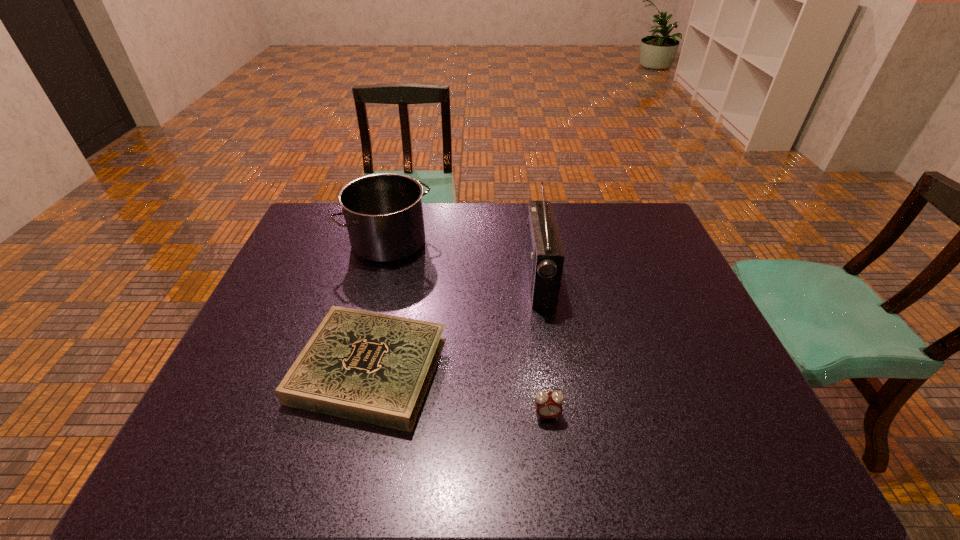
Identify the location of radio receiver. (544, 254).

At what (x,y) coordinates should I click in order to perform the action: click on saucepan. Please return your answer as a coordinate pair (x, y). The height and width of the screenshot is (540, 960). Looking at the image, I should click on (383, 212).

At what (x,y) coordinates should I click in order to perform the action: click on the third tallest object. Please return your answer as a coordinate pair (x, y). This screenshot has width=960, height=540. Looking at the image, I should click on click(548, 404).

Identify the location of hardback book. This screenshot has height=540, width=960. (375, 368).

In order to click on blank space located 0.360m on the front-facing side of the radio receiver in this screenshot , I will do `click(404, 278)`.

This screenshot has width=960, height=540. Identify the location of vacant space located on the front-facing side of the radio receiver. (503, 278).

Locate an element on the screen. This screenshot has height=540, width=960. free spot located on the front-facing side of the radio receiver is located at coordinates (439, 278).

In order to click on free region located on the front of the saucepan in this screenshot , I will do `click(376, 290)`.

What are the coordinates of `free location located 0.080m on the clock face of the alarm clock` in the screenshot? It's located at (552, 457).

Where is `free spot located 0.140m on the right of the shortest object`? The image size is (960, 540). free spot located 0.140m on the right of the shortest object is located at coordinates (503, 369).